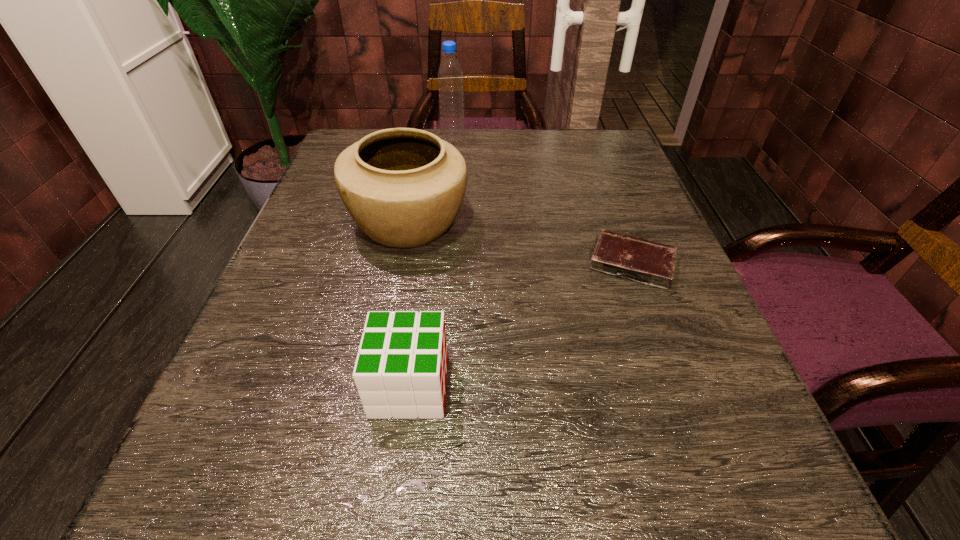
Find the location of a particular element. This screenshot has height=540, width=960. unoccupied position between the rightmost object and the pottery is located at coordinates (520, 244).

You are a GUI agent. You are given a task and a screenshot of the screen. Output one action in this format:
    pyautogui.click(x=<x>, y=<y>)
    Task: Click on the free space between the pottery and the shortest object
    
    Given the screenshot: What is the action you would take?
    pyautogui.click(x=520, y=244)

What are the coordinates of `empty location between the second tallest object and the shortest object` in the screenshot? It's located at (520, 244).

Identify the location of empty location between the farthest object and the cube. [x=431, y=263].

The image size is (960, 540). I want to click on empty space between the tallest object and the nearest object, so click(x=431, y=263).

You are a GUI agent. You are given a task and a screenshot of the screen. Output one action in this format:
    pyautogui.click(x=<x>, y=<y>)
    Task: Click on the free space between the nearest object and the shortest object
    The height and width of the screenshot is (540, 960).
    Given the screenshot: What is the action you would take?
    pyautogui.click(x=521, y=325)

Locate an element on the screen. unoccupied area between the shortest object and the water bottle is located at coordinates (542, 201).

The height and width of the screenshot is (540, 960). Identify the location of free space between the third shortest object and the rightmost object. (520, 244).

You are a GUI agent. You are given a task and a screenshot of the screen. Output one action in this format:
    pyautogui.click(x=<x>, y=<y>)
    Task: Click on the vacant area between the diary and the second shortest object
    
    Given the screenshot: What is the action you would take?
    pyautogui.click(x=521, y=325)

Image resolution: width=960 pixels, height=540 pixels. What are the coordinates of `the closest object to the second tallest object` in the screenshot? It's located at (400, 371).